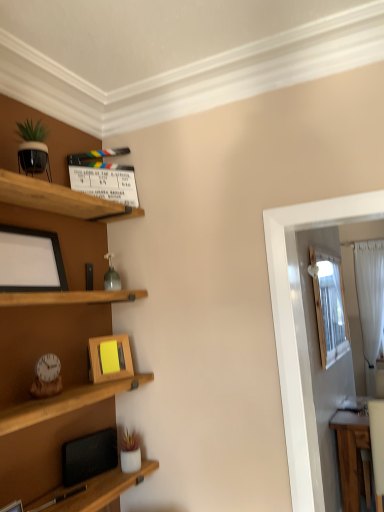
Question: Which direction should I rotate to look at wooden picture frame at center, which ranks as the 1th picture frame in back-to-front order, — up or down?

Choices:
 (A) up
 (B) down

Answer: (B)

Question: Does wooden picture frame at center, which ranks as the 2th picture frame in top-to-bottom order, turn towards white sheer curtain at right?

Choices:
 (A) yes
 (B) no

Answer: (B)

Question: Does wooden picture frame at center, which is the second picture frame in left-to-right order, have a lesser height compared to white sheer curtain at right?

Choices:
 (A) no
 (B) yes

Answer: (B)

Question: Can you see wooden picture frame at center, positioned as the 1th picture frame in right-to-left order, touching white sheer curtain at right?

Choices:
 (A) no
 (B) yes

Answer: (A)

Question: Is wooden picture frame at center, which ranks as the 1th picture frame in back-to-front order, closer to the viewer compared to white sheer curtain at right?

Choices:
 (A) no
 (B) yes

Answer: (B)

Question: Is wooden picture frame at center, positioned as the 1th picture frame in right-to-left order, outside of white sheer curtain at right?

Choices:
 (A) no
 (B) yes

Answer: (B)

Question: Does wooden picture frame at center, which is the 2th picture frame in front-to-back order, appear on the right side of white sheer curtain at right?

Choices:
 (A) yes
 (B) no

Answer: (B)

Question: Does white sheer curtain at right contain wooden picture frame at center, which ranks as the 2th picture frame in top-to-bottom order?

Choices:
 (A) yes
 (B) no

Answer: (B)

Question: Does white sheer curtain at right have a greater height compared to wooden picture frame at center, which is the 2th picture frame in front-to-back order?

Choices:
 (A) no
 (B) yes

Answer: (B)

Question: Does white sheer curtain at right appear on the left side of wooden picture frame at center, which is the second picture frame in left-to-right order?

Choices:
 (A) no
 (B) yes

Answer: (A)

Question: Is white sheer curtain at right not close to wooden picture frame at center, positioned as the 1th picture frame in right-to-left order?

Choices:
 (A) yes
 (B) no

Answer: (A)

Question: Does white sheer curtain at right appear on the right side of wooden picture frame at center, which is the second picture frame in left-to-right order?

Choices:
 (A) yes
 (B) no

Answer: (A)

Question: Considering the relative sizes of white sheer curtain at right and wooden picture frame at center, which ranks as the 1th picture frame in back-to-front order, in the image provided, is white sheer curtain at right thinner than wooden picture frame at center, which ranks as the 1th picture frame in back-to-front order,?

Choices:
 (A) yes
 (B) no

Answer: (B)

Question: Does matte black picture frame at left, marked as the 2th picture frame in a bottom-to-top arrangement, appear on the right side of white sheer curtain at right?

Choices:
 (A) yes
 (B) no

Answer: (B)